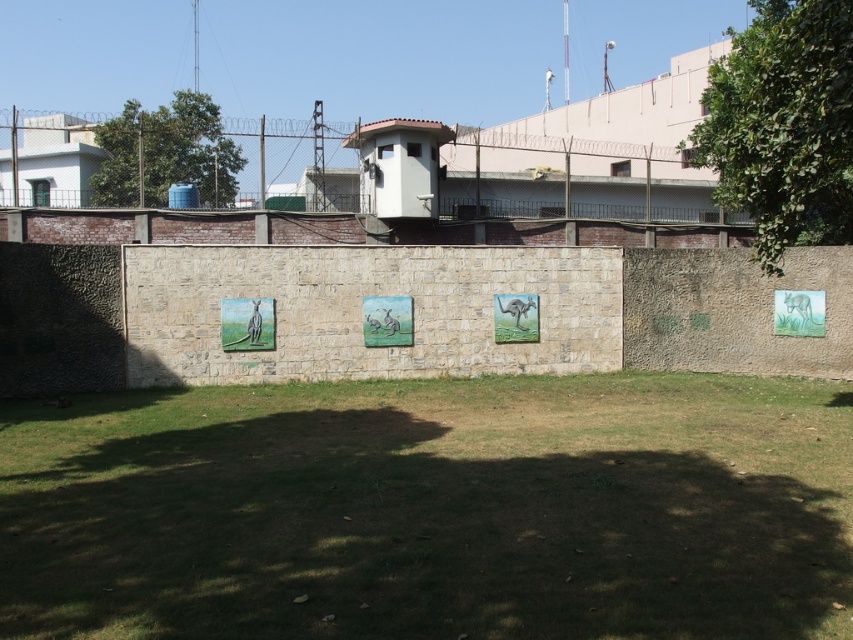
Question: Does green grass at center appear over matte ceramic camel at center?

Choices:
 (A) yes
 (B) no

Answer: (B)

Question: Estimate the real-world distances between objects in this image. Which object is closer to the pastel acrylic painting of kangaroos at center?

Choices:
 (A) green glossy kangaroo at right
 (B) green grass at center
 (C) green leafy tree at upper right
 (D) green leafy tree at upper left

Answer: (B)

Question: Is green leafy tree at upper right wider than green leafy tree at upper left?

Choices:
 (A) no
 (B) yes

Answer: (A)

Question: In this image, where is green matte kangaroo at left located relative to pastel acrylic painting of kangaroos at center?

Choices:
 (A) left
 (B) right

Answer: (A)

Question: Estimate the real-world distances between objects in this image. Which object is closer to the green grass at center?

Choices:
 (A) pastel acrylic painting of kangaroos at center
 (B) matte ceramic camel at center
 (C) green glossy kangaroo at right

Answer: (A)

Question: Among these points, which one is nearest to the camera?

Choices:
 (A) pyautogui.click(x=810, y=307)
 (B) pyautogui.click(x=781, y=134)
 (C) pyautogui.click(x=157, y=131)
 (D) pyautogui.click(x=252, y=321)

Answer: (B)